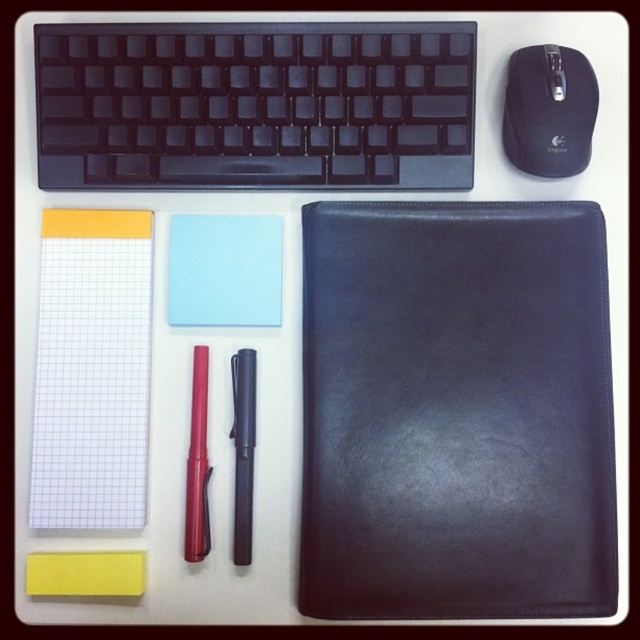
Question: Can you confirm if black plastic keyboard at upper left is wider than yellow matte notepad at lower left?

Choices:
 (A) no
 (B) yes

Answer: (B)

Question: Among these objects, which one is farthest from the camera?

Choices:
 (A) light blue paper at center
 (B) black plastic keyboard at upper left
 (C) black leather notebook at center
 (D) black matte pen at center

Answer: (A)

Question: Can you confirm if black plastic keyboard at upper left is wider than black matte pen at center?

Choices:
 (A) yes
 (B) no

Answer: (A)

Question: Is black leather notebook at center smaller than red glossy pen at center-left?

Choices:
 (A) yes
 (B) no

Answer: (B)

Question: Which point appears closest to the camera in this image?

Choices:
 (A) (90, 570)
 (B) (195, 556)
 (C) (148, 49)
 (D) (448, 301)

Answer: (A)

Question: Which point is farther to the camera?

Choices:
 (A) (576, 102)
 (B) (234, 163)
 (C) (116, 573)

Answer: (B)